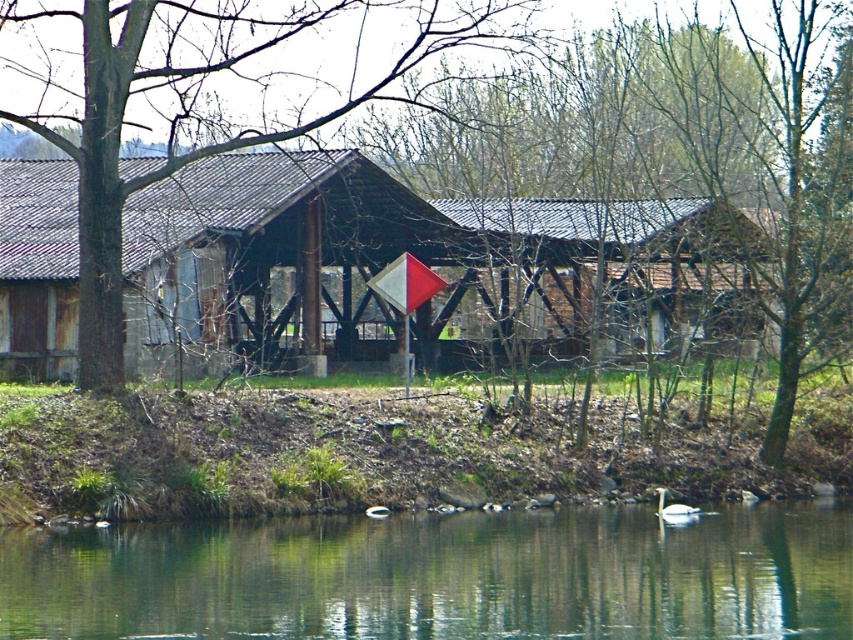
You are standing on the dock and see the green smooth water at lower center and the white glossy swan at lower center. Which object is closer to the left edge of the dock?

The green smooth water at lower center is positioned on the left side of the white glossy swan at lower center, so it is closer to the left edge of the dock.

You are a photographer trying to capture both the rusty wood barn at center and the white glossy swan at lower center in a single frame. Given that the barn is larger, where should you position yourself relative to the barn to ensure both subjects are clearly visible in your photo?

Since the rusty wood barn at center is bigger than the white glossy swan at lower center, you should position yourself closer to the barn to balance their sizes in the frame, ensuring both the barn and the swan are clearly visible.